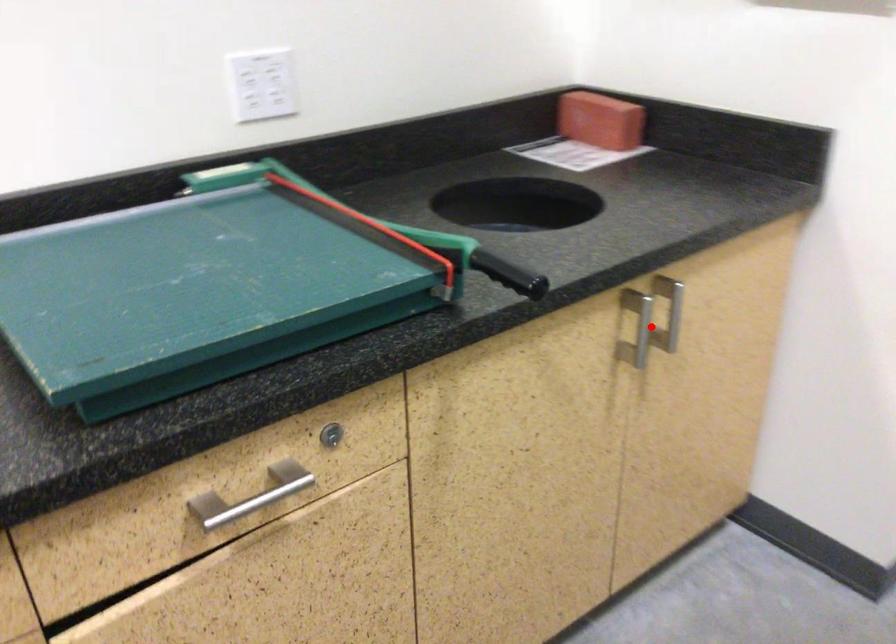
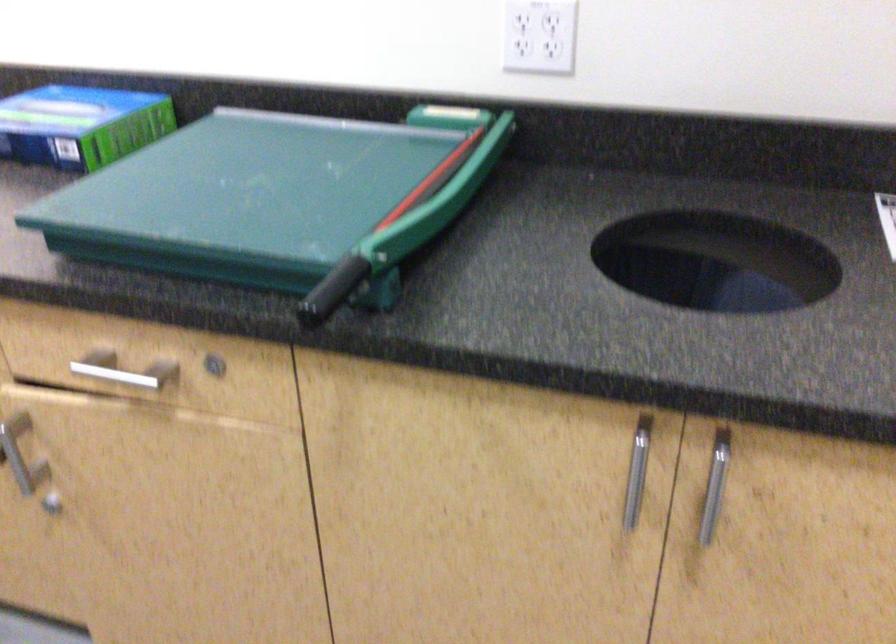
Question: I am providing you with two images of the same scene from different viewpoints. Given a red point in image1, look at the same physical point in image2. Is it:

Choices:
 (A) Closer to the viewpoint
 (B) Farther from the viewpoint

Answer: (A)